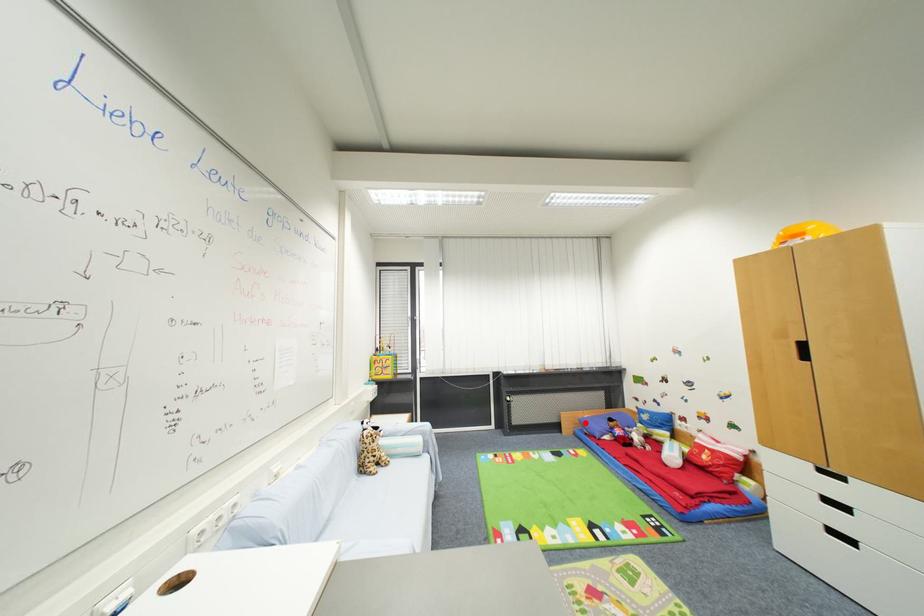
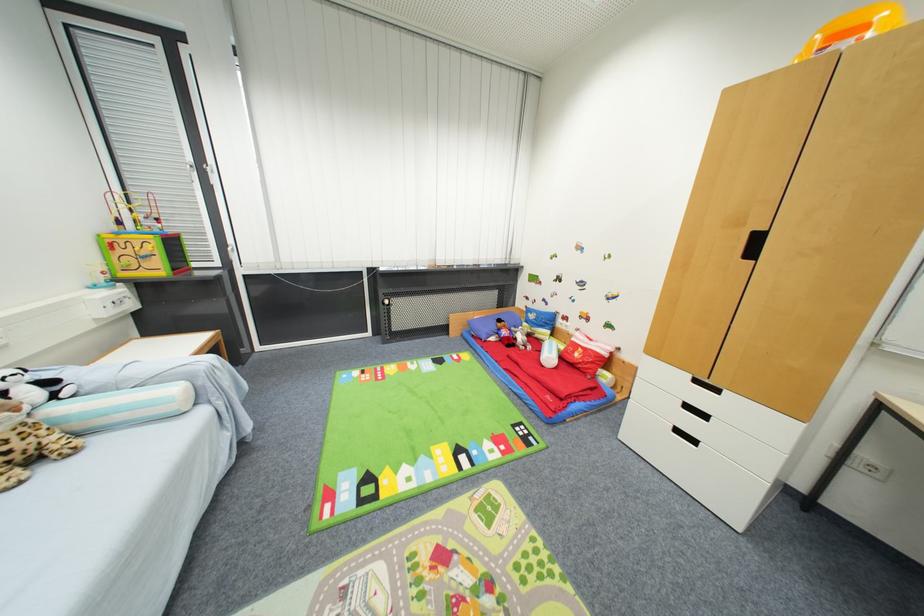
Find the pixel in the second image that matches the highlighted location in the first image.

(475, 325)